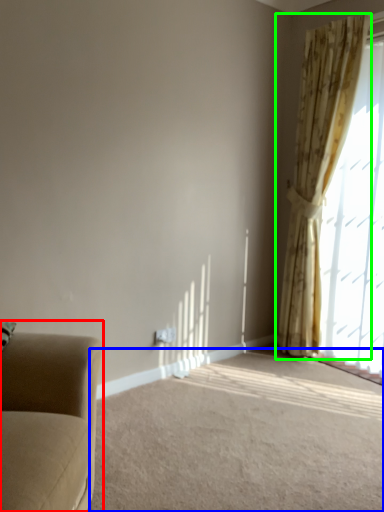
Question: Which object is positioned closest to studio couch (highlighted by a red box)? Select from plain (highlighted by a blue box) and curtain (highlighted by a green box).

Choices:
 (A) plain
 (B) curtain

Answer: (A)